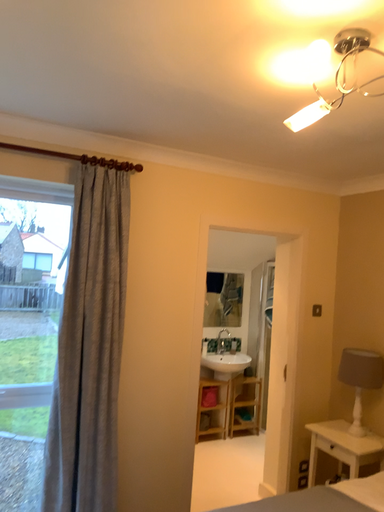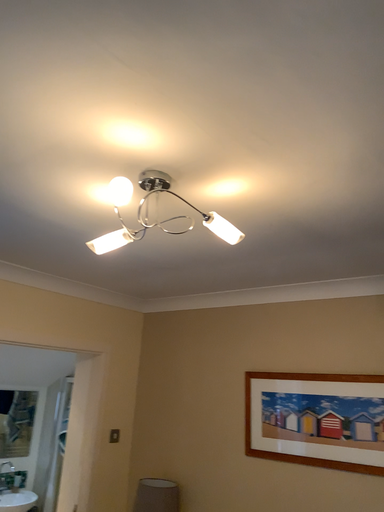
Question: Which way did the camera rotate in the video?

Choices:
 (A) rotated left
 (B) rotated right

Answer: (B)